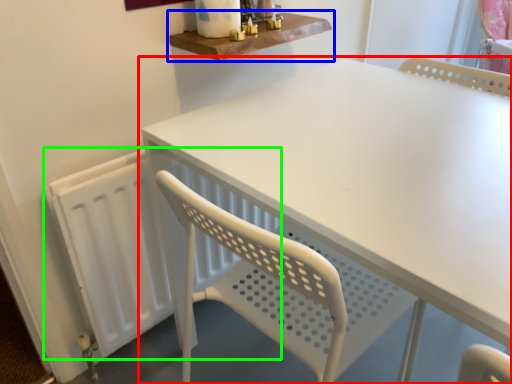
Question: Estimate the real-world distances between objects in this image. Which object is closer to table (highlighted by a red box), shelf (highlighted by a blue box) or radiator (highlighted by a green box)?

Choices:
 (A) shelf
 (B) radiator

Answer: (A)